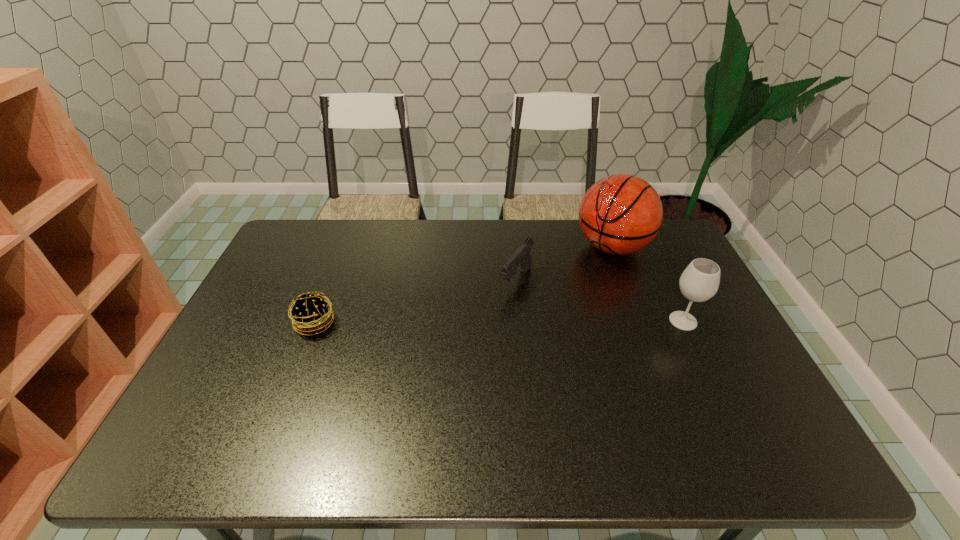
At what (x,y) coordinates should I click in order to perform the action: click on vacant space situated 0.360m at the barrel of the second shortest object. Please return your answer as a coordinate pair (x, y). The image size is (960, 540). Looking at the image, I should click on (440, 380).

The image size is (960, 540). Identify the location of vacant position located 0.370m on the side with spill of the tallest object. (511, 318).

Where is `vacant space situated 0.160m on the side with spill of the tallest object`? The width and height of the screenshot is (960, 540). vacant space situated 0.160m on the side with spill of the tallest object is located at coordinates (558, 285).

Locate an element on the screen. This screenshot has height=540, width=960. free space located on the side with spill of the tallest object is located at coordinates (549, 291).

Find the location of a particular element. The width and height of the screenshot is (960, 540). object present at the far edge is located at coordinates 620,214.

The image size is (960, 540). I want to click on wineglass that is at the right edge, so click(x=699, y=282).

Find the location of `basketball at the right edge`. basketball at the right edge is located at coordinates (620, 214).

Image resolution: width=960 pixels, height=540 pixels. What are the coordinates of `object situated at the far right corner` in the screenshot? It's located at (620, 214).

You are a GUI agent. You are given a task and a screenshot of the screen. Output one action in this format:
    pyautogui.click(x=<x>, y=<y>)
    Task: Click on the vacant space at the far edge of the desktop
    This screenshot has width=960, height=540.
    Given the screenshot: What is the action you would take?
    click(396, 233)

Identify the location of vacant area at the near edge of the desktop. The image size is (960, 540). (279, 413).